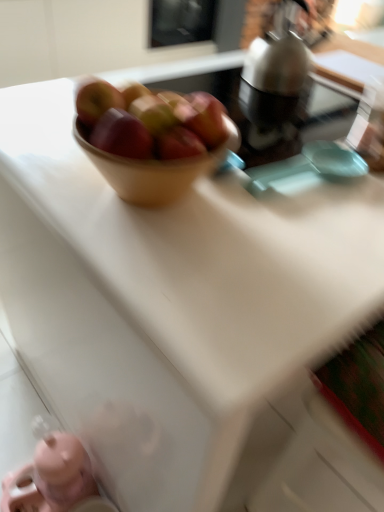
This screenshot has width=384, height=512. Identify the location of free space in front of satin silver coffeepot at upper right. (274, 109).